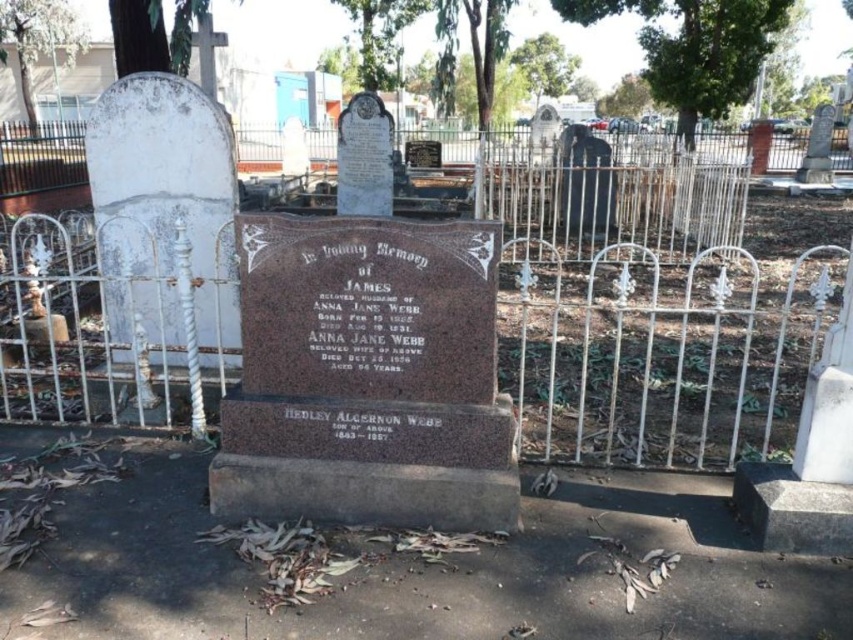
Can you confirm if white wrought iron fence at center is wider than brown polished stone gravestone at center?

No, white wrought iron fence at center is not wider than brown polished stone gravestone at center.

Is white wrought iron fence at center in front of brown polished stone gravestone at center?

That is False.

Does point (639, 429) lie behind point (241, 504)?

That is True.

Find the location of a particular element. This screenshot has height=640, width=853. white wrought iron fence at center is located at coordinates (659, 353).